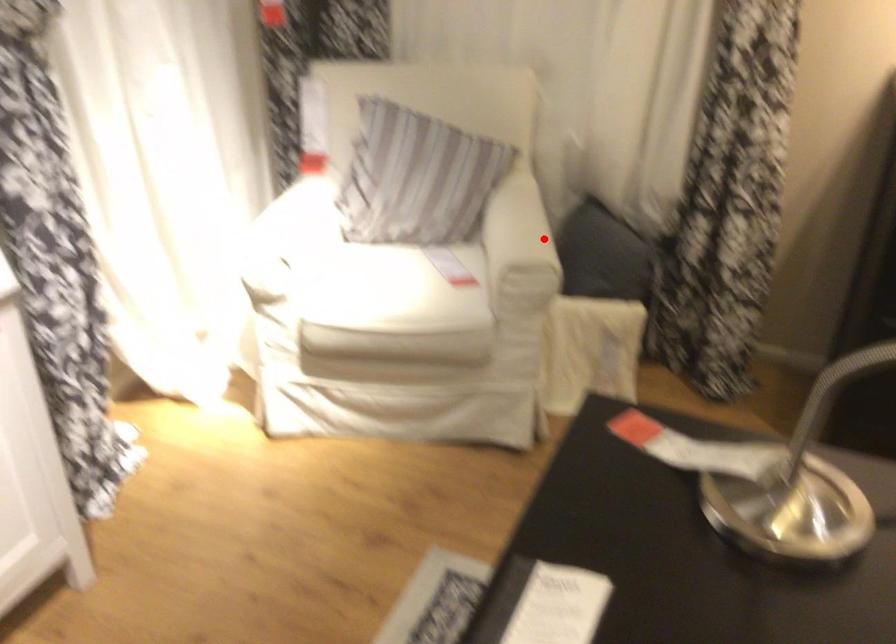
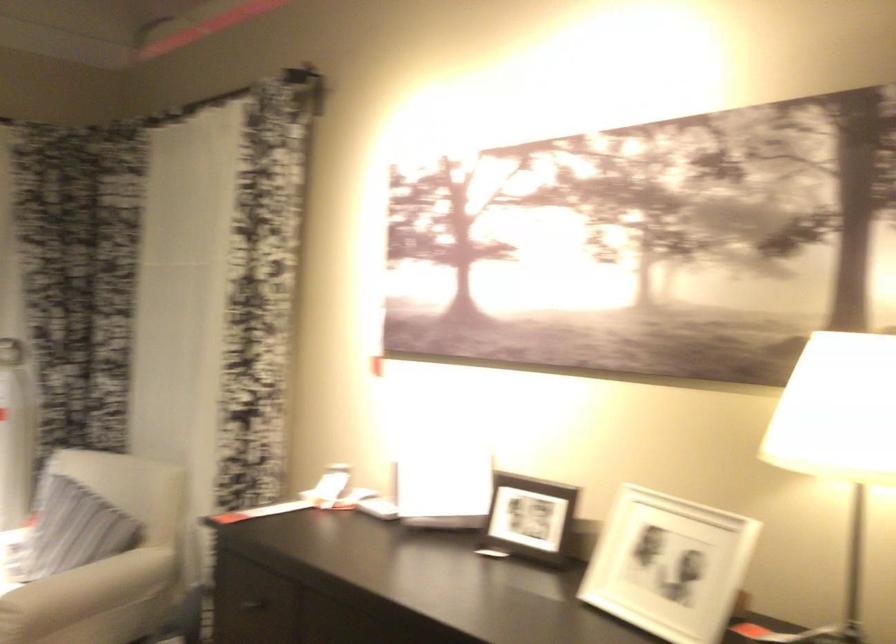
Locate, in the second image, the point that corresponds to the highlighted location in the first image.

(85, 592)